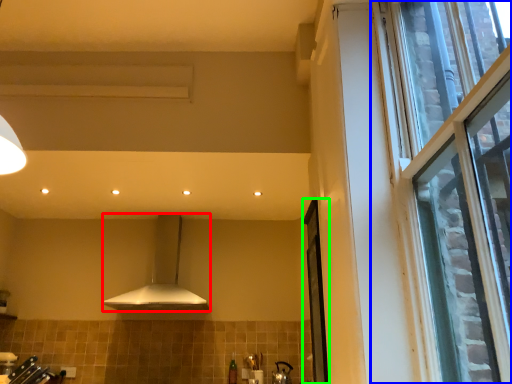
Question: Which is nearer to the kitchen appliance (highlighted by a red box)? window (highlighted by a blue box) or screen door (highlighted by a green box).

Choices:
 (A) window
 (B) screen door

Answer: (B)